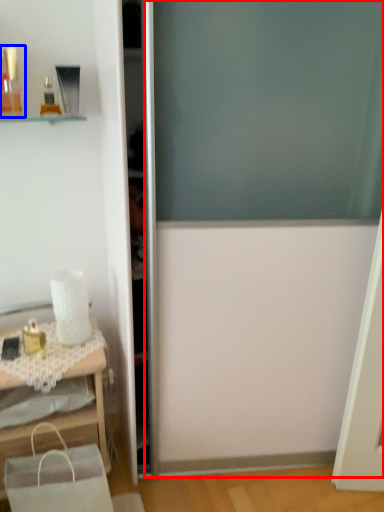
Question: Which of the following is the closest to the observer, screen door (highlighted by a red box) or toiletry (highlighted by a blue box)?

Choices:
 (A) screen door
 (B) toiletry

Answer: (A)